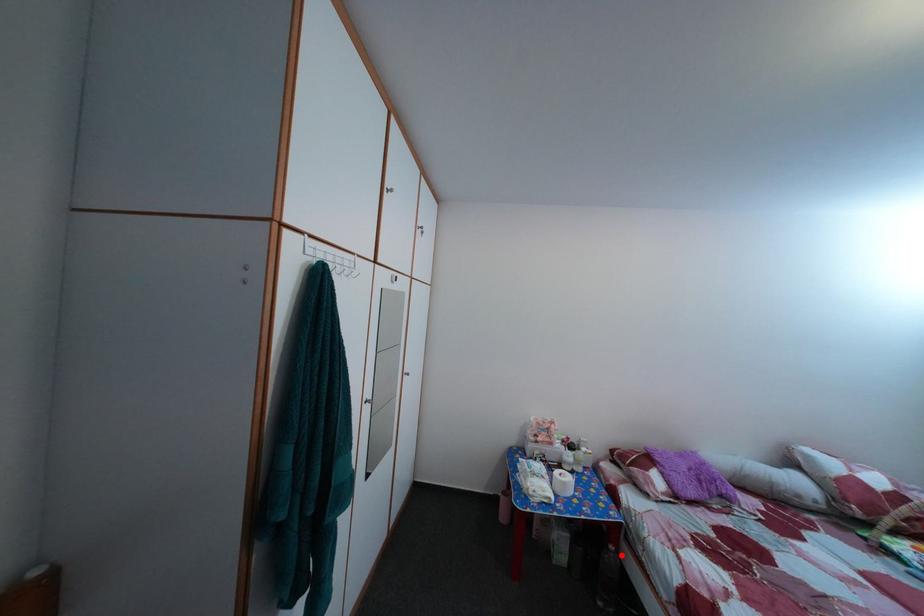
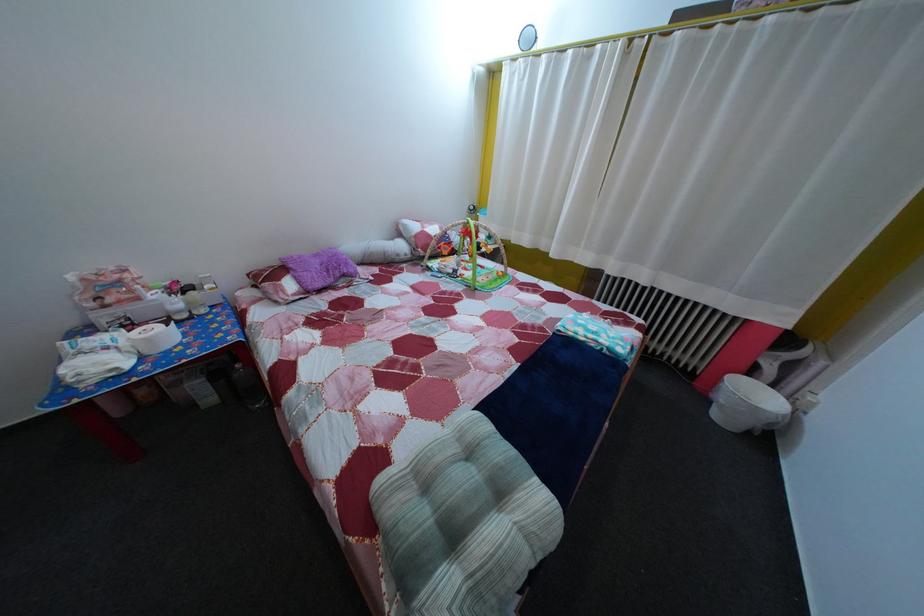
The point at the highlighted location is marked in the first image. Where is the corresponding point in the second image?

(248, 374)